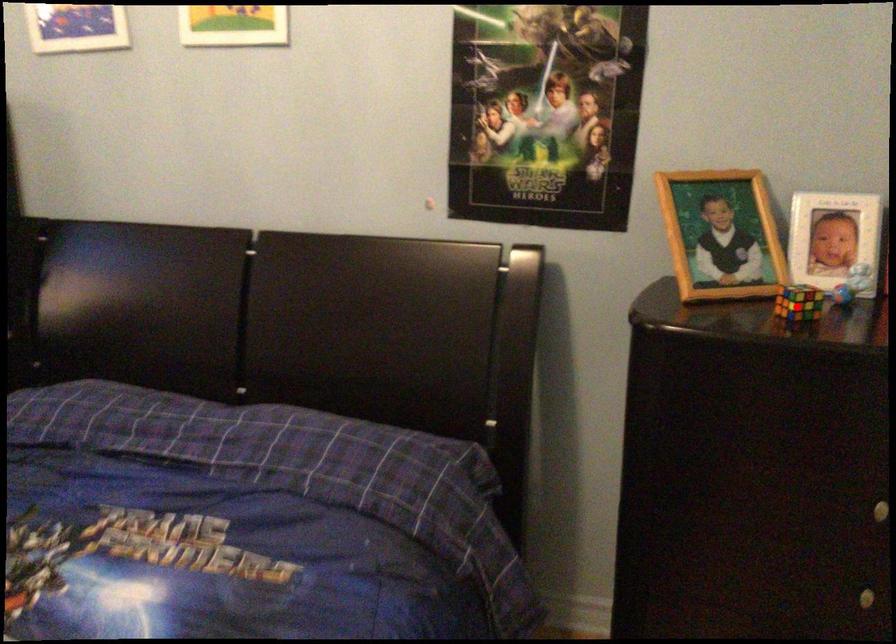
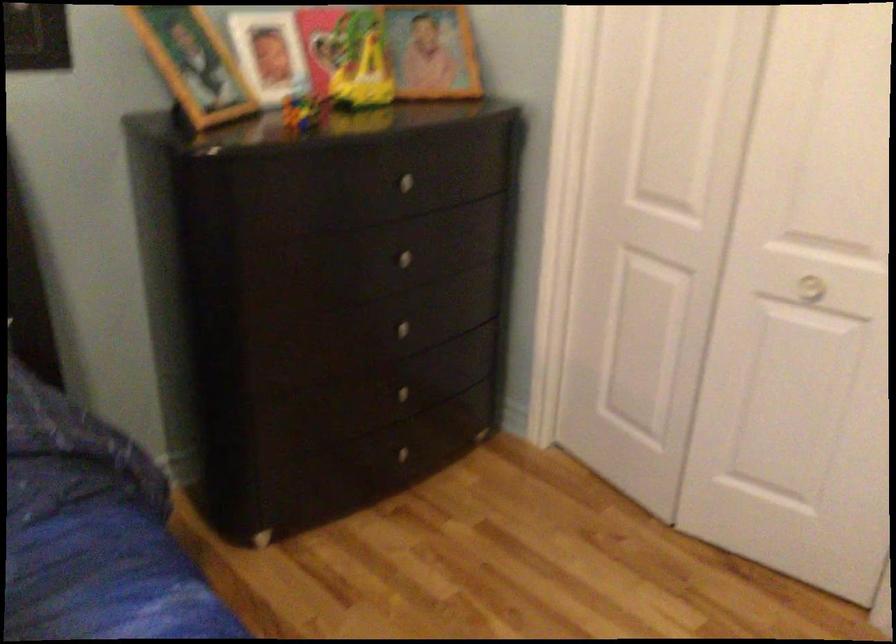
Question: I am providing you with two images of the same scene from different viewpoints. In image1, a red point is highlighted. Considering the same 3D point in image2, which of the following is correct?

Choices:
 (A) It is closer
 (B) It is farther

Answer: (B)